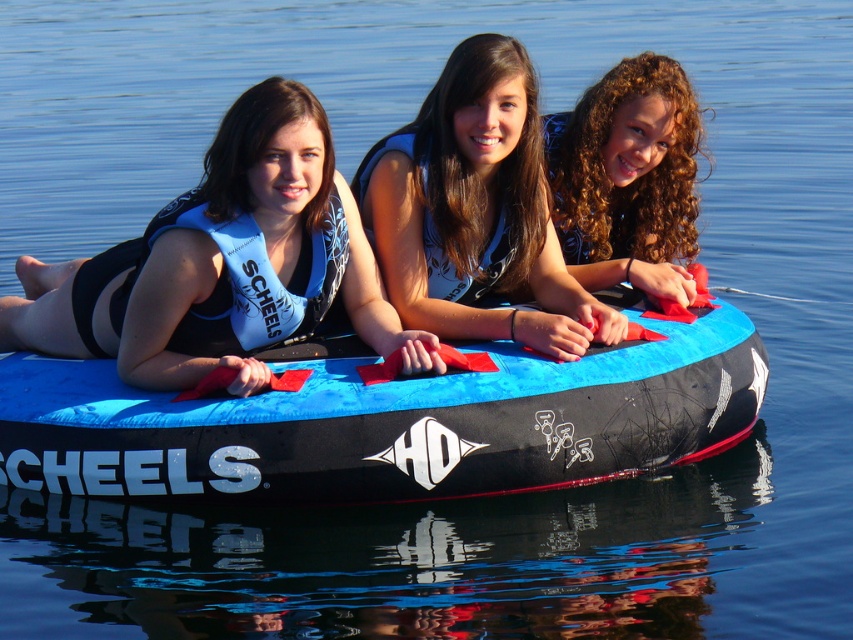
Which is behind, point (378, 385) or point (630, 140)?

Point (630, 140)

Is blue fabric tube at center shorter than curly hair at center?

Incorrect, blue fabric tube at center's height does not fall short of curly hair at center's.

The height and width of the screenshot is (640, 853). Identify the location of blue fabric tube at center. (387, 420).

Image resolution: width=853 pixels, height=640 pixels. Find the location of `blue fabric tube at center`. blue fabric tube at center is located at coordinates (387, 420).

Does blue fabric tube at center appear on the left side of blue fabric life vest at center?

Yes, blue fabric tube at center is to the left of blue fabric life vest at center.

Is point (154, 435) closer to camera compared to point (424, 112)?

Yes, point (154, 435) is in front of point (424, 112).

Does point (386, 461) come behind point (576, 342)?

That is False.

Find the location of a particular element. The height and width of the screenshot is (640, 853). blue fabric tube at center is located at coordinates click(x=387, y=420).

Between blue fabric tube at center and matte blue life vest at left, which one has more height?

Standing taller between the two is blue fabric tube at center.

Can you confirm if blue fabric tube at center is shorter than matte blue life vest at left?

In fact, blue fabric tube at center may be taller than matte blue life vest at left.

Which is in front, point (405, 438) or point (303, 285)?

Positioned in front is point (405, 438).

At what (x,y) coordinates should I click in order to perform the action: click on blue fabric tube at center. Please return your answer as a coordinate pair (x, y). Looking at the image, I should click on (387, 420).